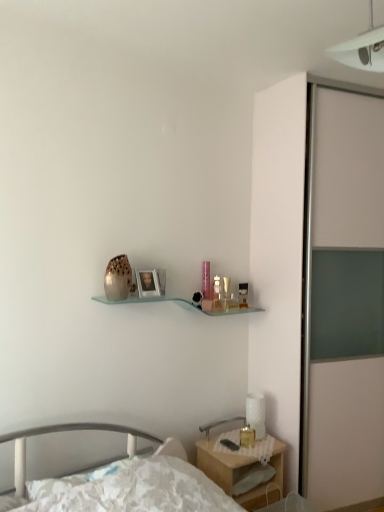
Question: Considering the positions of white plastic light fixture at upper right and translucent glass candle at bedside in the image, is white plastic light fixture at upper right wider or thinner than translucent glass candle at bedside?

Choices:
 (A) thin
 (B) wide

Answer: (B)

Question: Choose the correct answer: Is white plastic light fixture at upper right inside translucent glass candle at bedside or outside it?

Choices:
 (A) outside
 (B) inside

Answer: (A)

Question: Which of these objects is positioned closest to the translucent glass perfume bottle at upper center, the first toiletry positioned from the front?

Choices:
 (A) wooden nightstand at lower right
 (B) white matte sliding door at right
 (C) translucent glass perfume bottle at upper center, placed as the 1th toiletry when sorted from back to front
 (D) white plastic light fixture at upper right
 (E) brown textured vase at center

Answer: (C)

Question: Which object is the farthest from the wooden nightstand at lower right?

Choices:
 (A) translucent glass candle at bedside
 (B) white floral fabric bed at lower left
 (C) white textured table lamp at lower right
 (D) translucent glass perfume bottle at upper center, marked as the second toiletry in a front-to-back arrangement
 (E) white matte sliding door at right

Answer: (D)